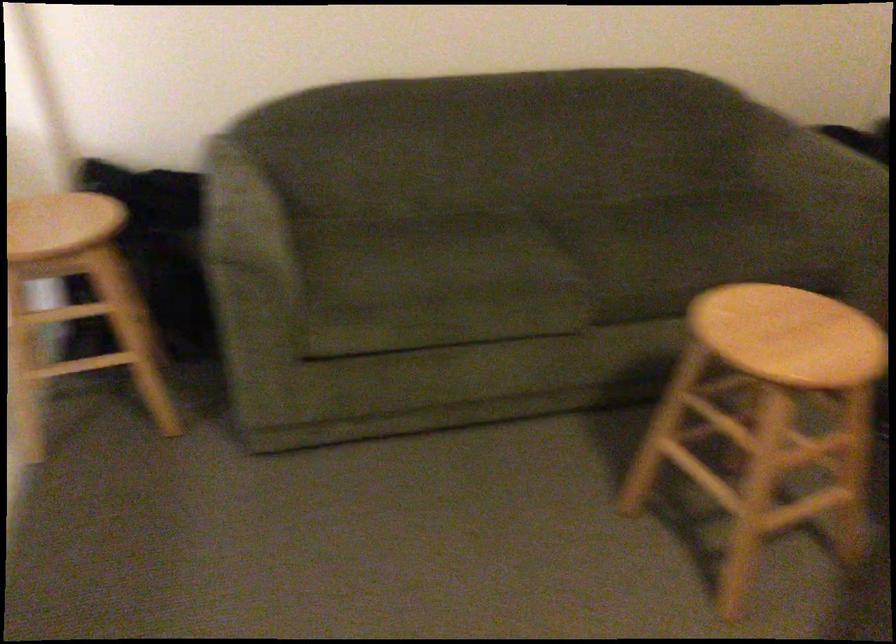
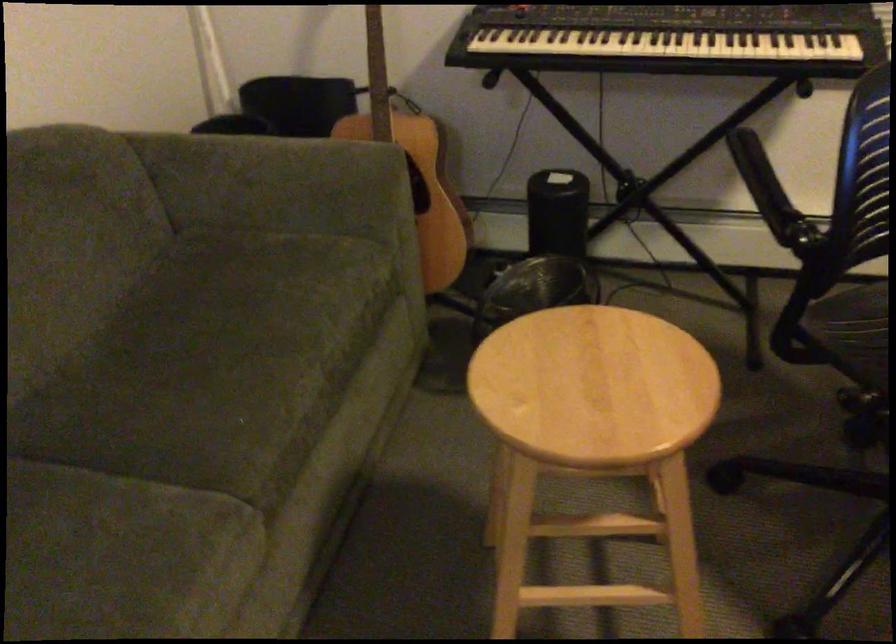
Locate, in the second image, the point that corresponds to (514,266) in the first image.

(122, 556)